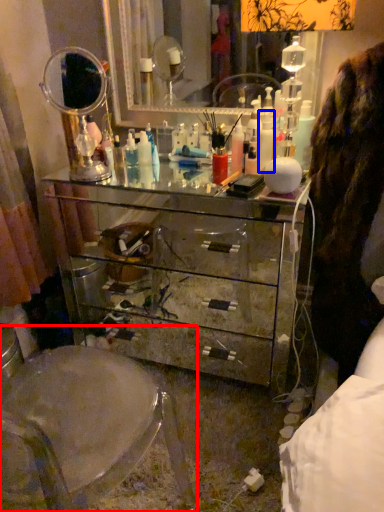
Question: Which object appears farthest to the camera in this image, swivel chair (highlighted by a red box) or toiletry (highlighted by a blue box)?

Choices:
 (A) swivel chair
 (B) toiletry

Answer: (B)